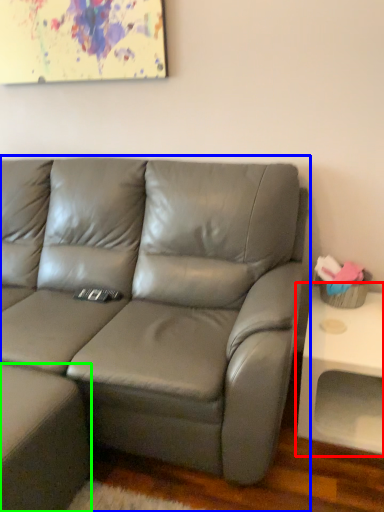
Question: Estimate the real-world distances between objects in this image. Which object is closer to table (highlighted by a red box), studio couch (highlighted by a blue box) or footrest (highlighted by a green box)?

Choices:
 (A) studio couch
 (B) footrest

Answer: (A)